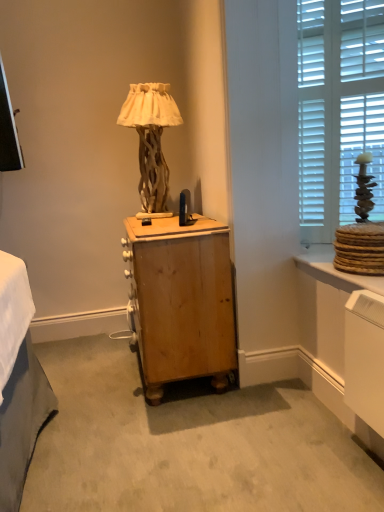
Where is `vacant region to the left of wooden nightstand at center`? vacant region to the left of wooden nightstand at center is located at coordinates (89, 371).